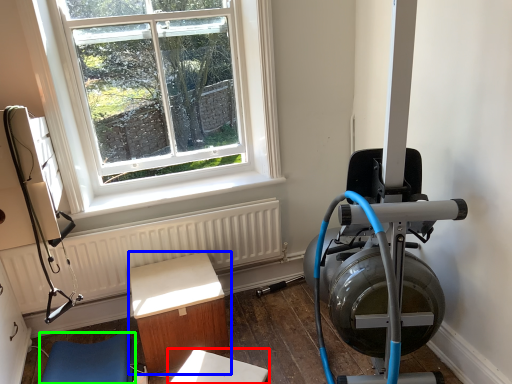
Question: Based on their relative distances, which object is nearer to table (highlighted by a red box)? Choose from furniture (highlighted by a blue box) and furniture (highlighted by a green box).

Choices:
 (A) furniture
 (B) furniture

Answer: (A)